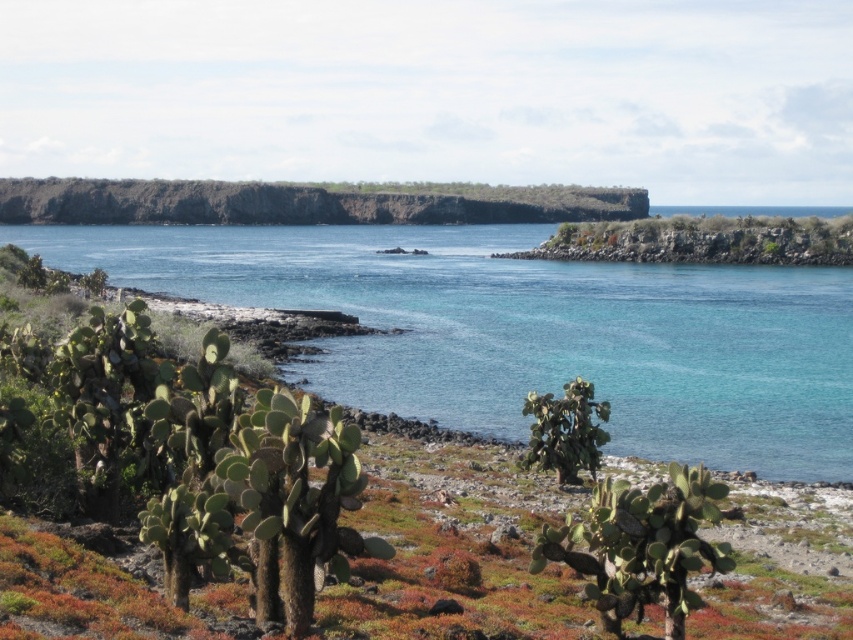
Between clear blue water at lower left and dark brown rocky cliff at upper center, which one appears on the right side from the viewer's perspective?

clear blue water at lower left is more to the right.

Consider the image. How much distance is there between clear blue water at lower left and dark brown rocky cliff at upper center?

74.90 meters

In order to click on clear blue water at lower left in this screenshot , I will do `click(529, 332)`.

Identify the location of clear blue water at lower left. Image resolution: width=853 pixels, height=640 pixels. (529, 332).

Who is lower down, clear blue water at lower left or green spiny cactus at center?

green spiny cactus at center

Between clear blue water at lower left and green spiny cactus at center, which one has less height?

With less height is green spiny cactus at center.

Is point (770, 392) positioned before point (601, 438)?

That is False.

This screenshot has height=640, width=853. In order to click on clear blue water at lower left in this screenshot , I will do `click(529, 332)`.

Where is `dark brown rocky cliff at upper center`? Image resolution: width=853 pixels, height=640 pixels. dark brown rocky cliff at upper center is located at coordinates (305, 202).

I want to click on dark brown rocky cliff at upper center, so click(x=305, y=202).